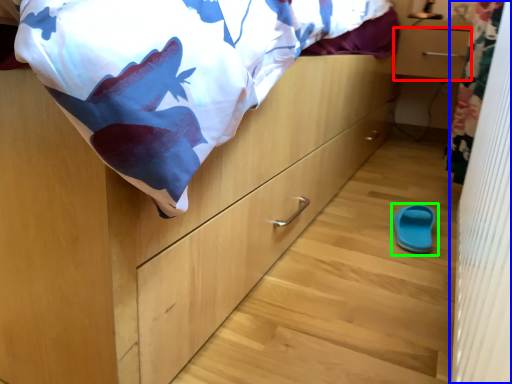
Question: Which object is the farthest from drawer (highlighted by a red box)? Choose among these: curtain (highlighted by a blue box) or footwear (highlighted by a green box).

Choices:
 (A) curtain
 (B) footwear

Answer: (A)